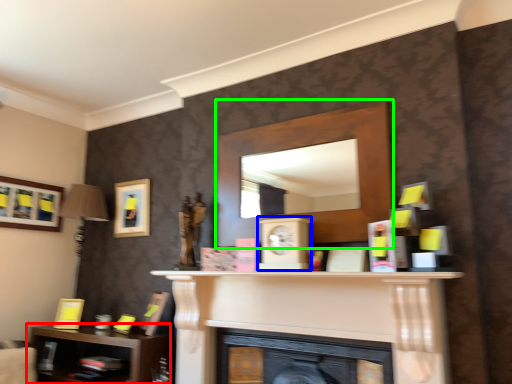
Question: Which object is the closest to the shelf (highlighted by a red box)? Choose among these: clock (highlighted by a blue box) or shelf (highlighted by a green box).

Choices:
 (A) clock
 (B) shelf

Answer: (B)